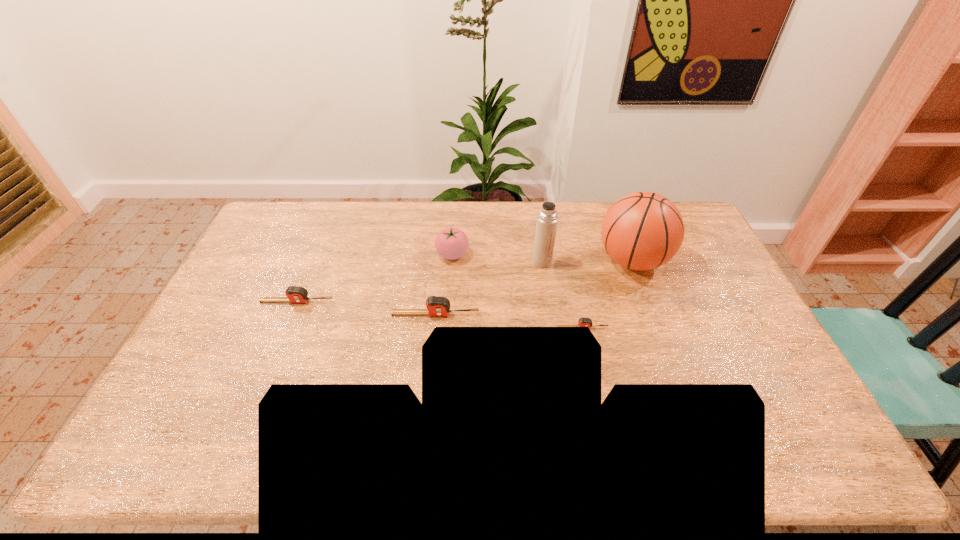
Identify the location of vacant position located 0.320m on the back of the second tape measure from right to left. The height and width of the screenshot is (540, 960). (443, 243).

Where is `vacant region located 0.140m on the back of the nearest tape measure`? The height and width of the screenshot is (540, 960). vacant region located 0.140m on the back of the nearest tape measure is located at coordinates (574, 292).

You are a GUI agent. You are given a task and a screenshot of the screen. Output one action in this format:
    pyautogui.click(x=<x>, y=<y>)
    Task: Click on the free space located 0.160m on the left of the fourth shortest object
    
    Given the screenshot: What is the action you would take?
    pyautogui.click(x=390, y=254)

You are a GUI agent. You are given a task and a screenshot of the screen. Output one action in this format:
    pyautogui.click(x=<x>, y=<y>)
    Task: Click on the free space located 0.090m on the left of the rightmost object
    
    Given the screenshot: What is the action you would take?
    pyautogui.click(x=569, y=261)

Where is `free space located on the back of the thermos bottle`? free space located on the back of the thermos bottle is located at coordinates (539, 239).

In order to click on object present at the far edge in this screenshot , I will do `click(642, 231)`.

Where is `object that is at the left edge`? object that is at the left edge is located at coordinates (295, 294).

At what (x,y) coordinates should I click in order to perform the action: click on object situated at the right edge. Please return your answer as a coordinate pair (x, y). Looking at the image, I should click on (642, 231).

The image size is (960, 540). Identify the location of object present at the far right corner. (642, 231).

In the image, there is a desktop. Where is `blank space at the far edge`? This screenshot has height=540, width=960. blank space at the far edge is located at coordinates (453, 217).